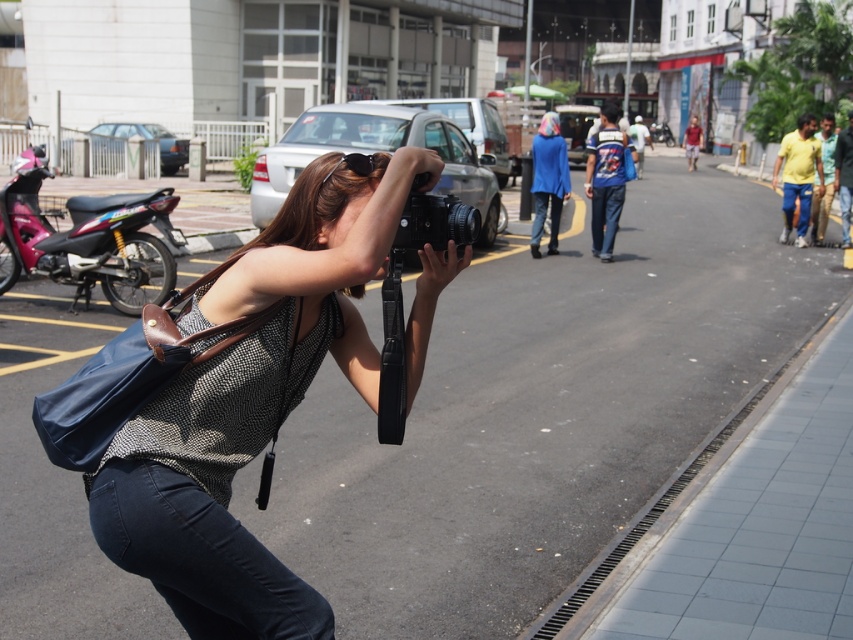
You are a photographer carrying your black matte camera at center and want to take a photo of the metallic pink motorcycle at left. However, there is a low hanging branch blocking your view. If you raise your camera higher, will the motorcycle be visible above the branch?

The metallic pink motorcycle at left is much taller than the black matte camera at center. Since the motorcycle is taller, raising the camera might allow you to see above the branch and capture the motorcycle.

You are a photographer trying to capture a clear shot of the matte black camera at center and the black matte camera at center. Which camera is positioned closer to your viewpoint?

The matte black camera at center is closer to the viewer than the black matte camera at center.